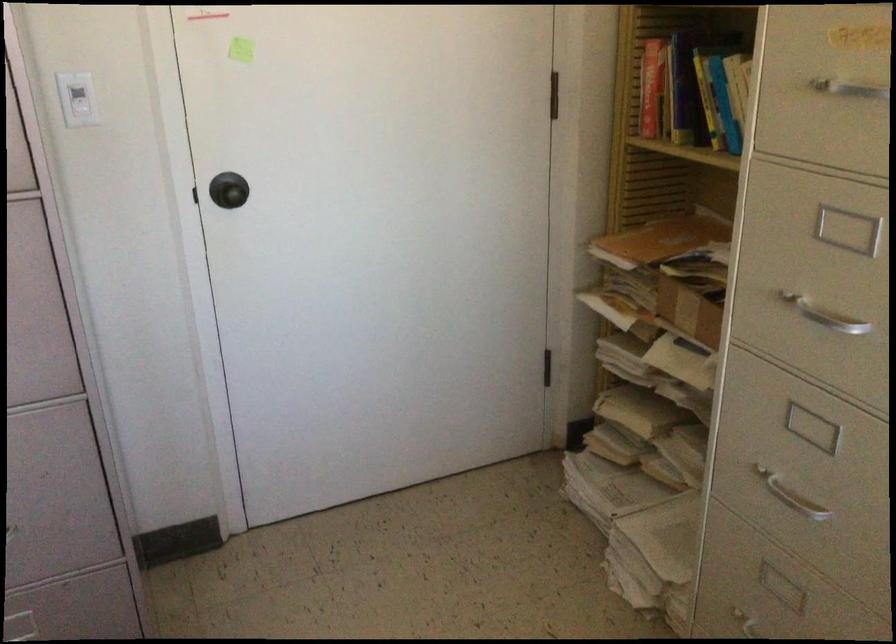
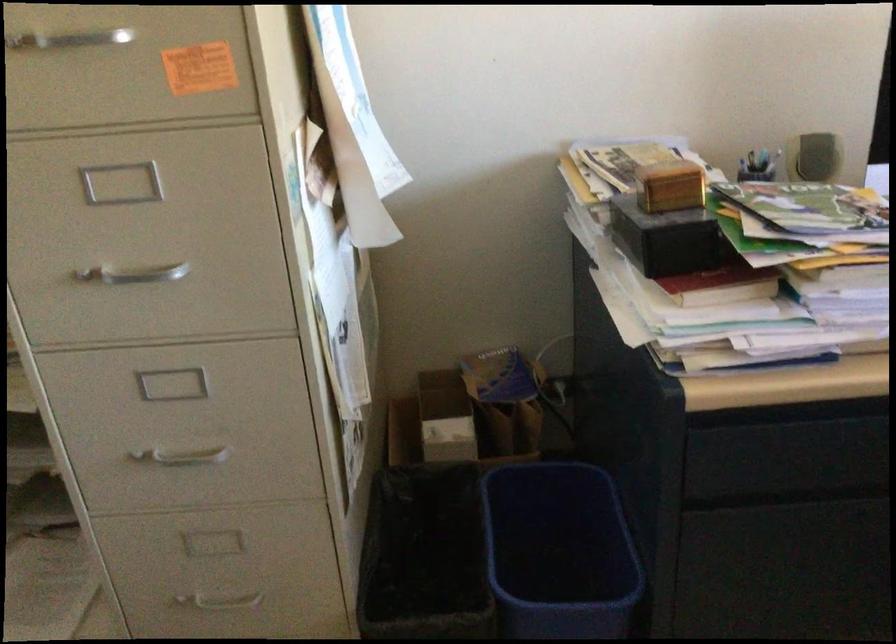
Question: I am providing you with two images of the same scene from different viewpoints. After the viewpoint changes to image2, which objects are now occluded?

Choices:
 (A) silver cabinet handle
 (B) black box
 (C) black trash bin
 (D) none of these

Answer: (D)